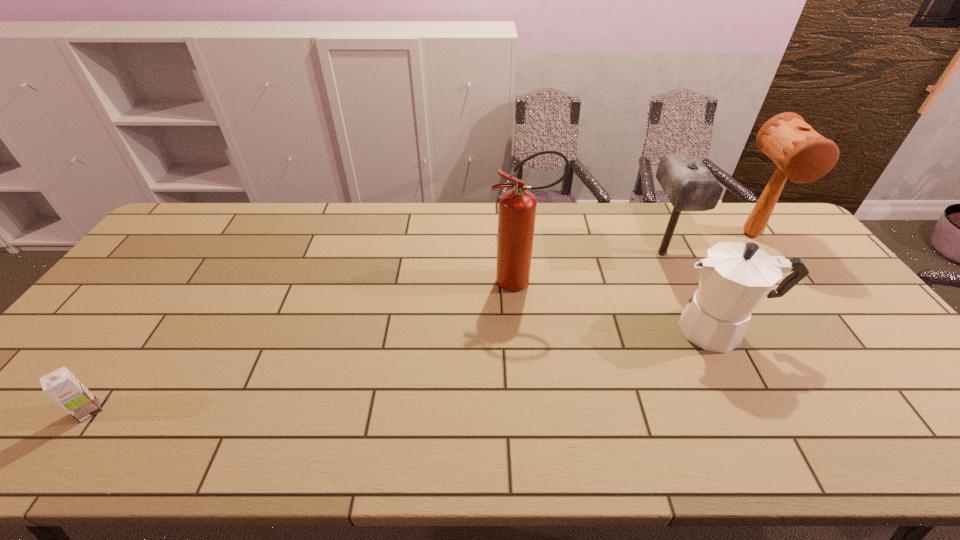
Locate an element on the screen. This screenshot has width=960, height=540. free space located on the strike surface of the rightmost object is located at coordinates (823, 331).

Image resolution: width=960 pixels, height=540 pixels. In order to click on blank area located on the front of the left mallet in this screenshot , I will do `click(686, 305)`.

Where is `vacant region located at the spout of the fourth tallest object`? The image size is (960, 540). vacant region located at the spout of the fourth tallest object is located at coordinates (616, 329).

The image size is (960, 540). What are the coordinates of `vacant area situated at the spout of the fourth tallest object` in the screenshot? It's located at (638, 329).

Locate an element on the screen. free space located 0.200m at the spout of the fourth tallest object is located at coordinates (593, 329).

The width and height of the screenshot is (960, 540). What are the coordinates of `free location located 0.180m on the right of the nearest object` in the screenshot? It's located at (181, 410).

This screenshot has height=540, width=960. Identify the location of object at the near edge. (61, 385).

This screenshot has width=960, height=540. Find the location of `object present at the left edge`. object present at the left edge is located at coordinates (61, 385).

Where is `object that is at the right edge`? object that is at the right edge is located at coordinates (802, 155).

This screenshot has height=540, width=960. Find the location of `object located in the near left corner section of the desktop`. object located in the near left corner section of the desktop is located at coordinates (61, 385).